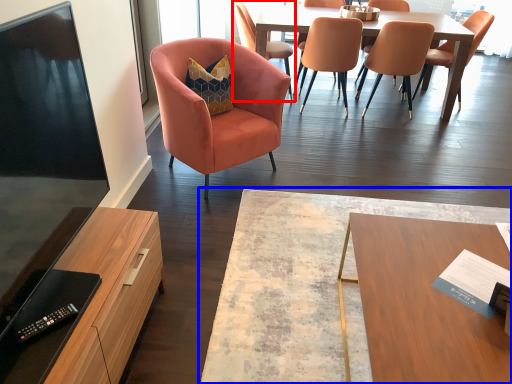
Question: Which of the following is the closest to the observer, chair (highlighted by a red box) or coffee table (highlighted by a blue box)?

Choices:
 (A) chair
 (B) coffee table

Answer: (B)